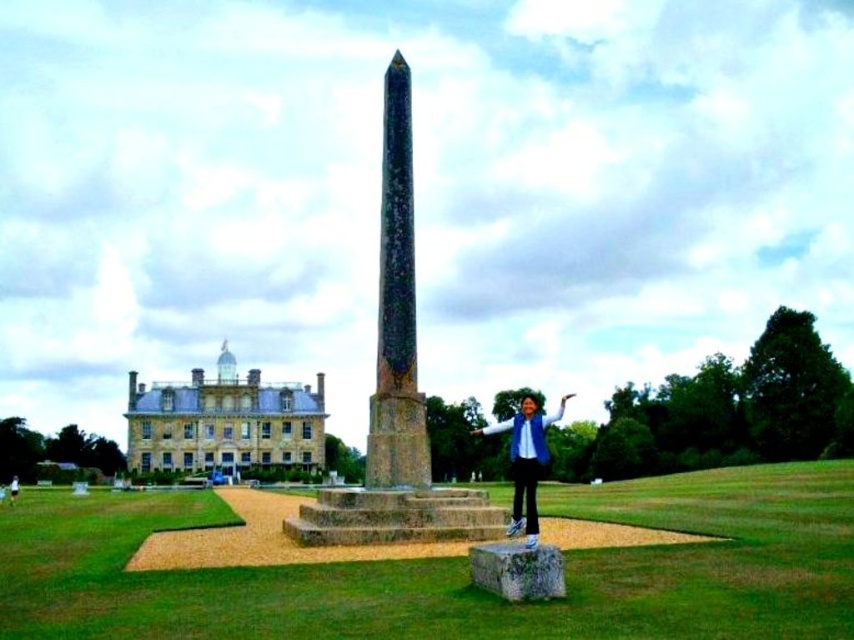
You are a photographer setting up for a group photo. You want to ensure that the black granite obelisk at center and the blue denim jacket at center are both visible in the frame. Given their sizes, which object should you focus on to keep both in the shot?

The black granite obelisk at center is taller than the blue denim jacket at center, so focusing on the obelisk will ensure both are in the frame as it is the taller object.